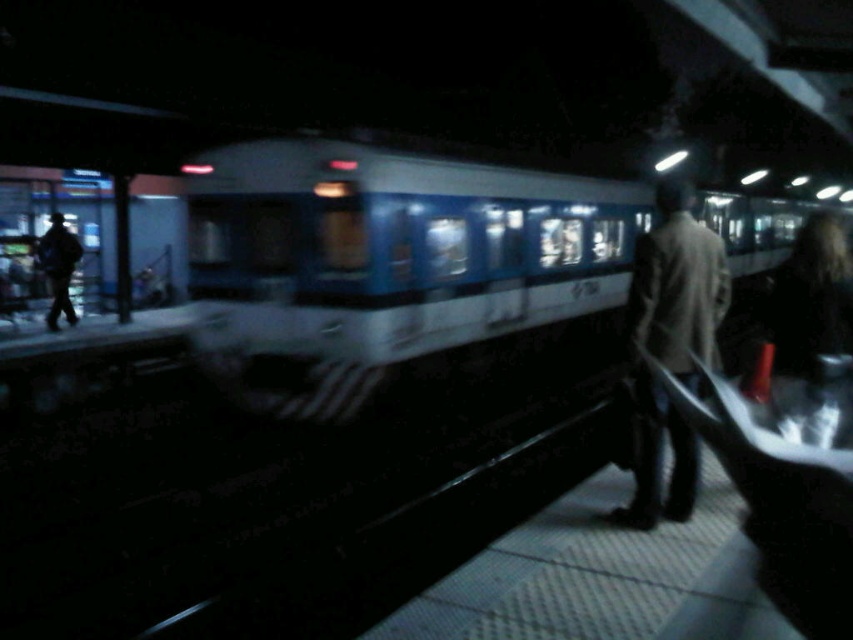
You are a photographer standing on the train station platform at night. You notice two people wearing coats. One is wearing a light brown leather jacket at center and the other a dark gray coat at left. Which person is shorter?

The light brown leather jacket at center is not as tall as dark gray coat at left, so the person wearing the light brown leather jacket at center is shorter.